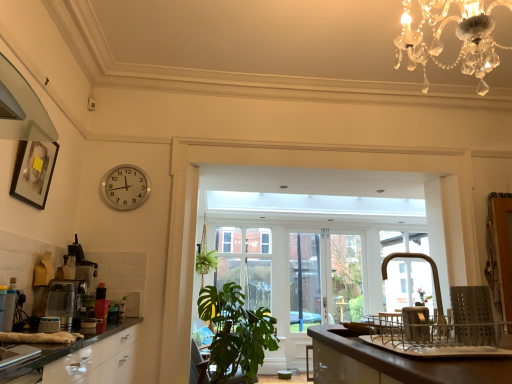
Find the location of a particular element. The width and height of the screenshot is (512, 384). brushed metal faucet at right is located at coordinates (432, 274).

Describe the element at coordinates (394, 363) in the screenshot. I see `brown glossy countertop at lower right` at that location.

What do you see at coordinates (245, 262) in the screenshot?
I see `clear glass window at center` at bounding box center [245, 262].

This screenshot has width=512, height=384. I want to click on satin silver dishwasher at lower right, acting as the 2th appliance starting from the left, so click(x=416, y=323).

Looking at this image, what is the approximate width of green leafy plant at lower center?

83.72 centimeters.

This screenshot has height=384, width=512. I want to click on satin silver coffee machine at left, which is counted as the first coffee machine, starting from the front, so click(x=64, y=301).

Would you say metallic silver toaster at left, which is the 2th appliance in right-to-left order, is a long distance from satin silver dishwasher at lower right, which ranks as the 2th appliance in back-to-front order?

Absolutely, metallic silver toaster at left, which is the 2th appliance in right-to-left order, is distant from satin silver dishwasher at lower right, which ranks as the 2th appliance in back-to-front order.

Identify the location of appliance below the satin silver dishwasher at lower right, marked as the first appliance in a right-to-left arrangement (from the image's perspective). (78, 266).

What's the angular difference between metallic silver toaster at left, the 1th appliance positioned from the left, and satin silver dishwasher at lower right, marked as the first appliance in a right-to-left arrangement,'s facing directions?

The facing directions of metallic silver toaster at left, the 1th appliance positioned from the left, and satin silver dishwasher at lower right, marked as the first appliance in a right-to-left arrangement, are 93.1 degrees apart.

Which of these two, metallic silver toaster at left, which ranks as the first appliance in back-to-front order, or satin silver dishwasher at lower right, marked as the first appliance in a right-to-left arrangement, is bigger?

metallic silver toaster at left, which ranks as the first appliance in back-to-front order, is bigger.

Considering the sizes of objects brown glossy countertop at lower right and satin silver dishwasher at lower right, which is counted as the first appliance, starting from the front, in the image provided, who is thinner, brown glossy countertop at lower right or satin silver dishwasher at lower right, which is counted as the first appliance, starting from the front,?

satin silver dishwasher at lower right, which is counted as the first appliance, starting from the front.

How many degrees apart are the facing directions of brown glossy countertop at lower right and satin silver dishwasher at lower right, which is counted as the first appliance, starting from the front?

There is a 94.2-degree angle between the facing directions of brown glossy countertop at lower right and satin silver dishwasher at lower right, which is counted as the first appliance, starting from the front.

Is satin silver dishwasher at lower right, which ranks as the 2th appliance in back-to-front order, at the back of brown glossy countertop at lower right?

Result: That's not correct — brown glossy countertop at lower right is not looking away from satin silver dishwasher at lower right, which ranks as the 2th appliance in back-to-front order.

From a real-world perspective, is brown glossy countertop at lower right positioned above or below satin silver dishwasher at lower right, marked as the first appliance in a right-to-left arrangement?

In terms of real-world spatial position, brown glossy countertop at lower right is below satin silver dishwasher at lower right, marked as the first appliance in a right-to-left arrangement.

Which object is closer to the camera, satin silver dishwasher at lower right, which ranks as the 2th appliance in back-to-front order, or silver metallic clock at upper left?

Positioned in front is satin silver dishwasher at lower right, which ranks as the 2th appliance in back-to-front order.

From a real-world perspective, who is located lower, satin silver dishwasher at lower right, which ranks as the 2th appliance in back-to-front order, or silver metallic clock at upper left?

satin silver dishwasher at lower right, which ranks as the 2th appliance in back-to-front order.

Is satin silver dishwasher at lower right, which ranks as the 2th appliance in back-to-front order, looking in the opposite direction of silver metallic clock at upper left?

That's not correct — satin silver dishwasher at lower right, which ranks as the 2th appliance in back-to-front order, is not looking away from silver metallic clock at upper left.

How different are the orientations of satin silver dishwasher at lower right, marked as the first appliance in a right-to-left arrangement, and silver metallic clock at upper left in degrees?

There is a 177-degree angle between the facing directions of satin silver dishwasher at lower right, marked as the first appliance in a right-to-left arrangement, and silver metallic clock at upper left.

Is satin silver coffee machine at left, positioned as the 1th coffee machine in back-to-front order, smaller than metallic silver toaster at left, which ranks as the first appliance in back-to-front order?

Yes.

Is satin silver coffee machine at left, the 2th coffee machine when ordered from front to back, to the left of metallic silver toaster at left, which is the 2th appliance in right-to-left order, from the viewer's perspective?

Incorrect, satin silver coffee machine at left, the 2th coffee machine when ordered from front to back, is not on the left side of metallic silver toaster at left, which is the 2th appliance in right-to-left order.

From a real-world perspective, between satin silver coffee machine at left, the 2th coffee machine when ordered from front to back, and metallic silver toaster at left, which is the second appliance in front-to-back order, who is vertically lower?

satin silver coffee machine at left, the 2th coffee machine when ordered from front to back, from a real-world perspective.

In the scene shown: Is satin silver coffee machine at left, the 2th coffee machine when ordered from front to back, beside metallic silver toaster at left, the 1th appliance positioned from the left?

Absolutely, satin silver coffee machine at left, the 2th coffee machine when ordered from front to back, is next to and touching metallic silver toaster at left, the 1th appliance positioned from the left.

Would you say clear glass window at center contains satin silver coffee machine at left, the 2th coffee machine when ordered from front to back?

That's incorrect, satin silver coffee machine at left, the 2th coffee machine when ordered from front to back, is not inside clear glass window at center.

How different are the orientations of clear glass window at center and satin silver coffee machine at left, the 2th coffee machine when ordered from front to back, in degrees?

They differ by 92.8 degrees in their facing directions.

From a real-world perspective, which is physically above, clear glass window at center or satin silver coffee machine at left, the 2th coffee machine when ordered from front to back?

In real-world perspective, clear glass window at center is above.

Is clear glass window at center oriented towards satin silver coffee machine at left, positioned as the 1th coffee machine in back-to-front order?

Yes, clear glass window at center is facing satin silver coffee machine at left, positioned as the 1th coffee machine in back-to-front order.

In terms of size, does satin silver dishwasher at lower right, acting as the 2th appliance starting from the left, appear bigger or smaller than satin silver coffee machine at left, placed as the second coffee machine when sorted from back to front?

Considering their sizes, satin silver dishwasher at lower right, acting as the 2th appliance starting from the left, takes up less space than satin silver coffee machine at left, placed as the second coffee machine when sorted from back to front.

Considering the positions of points (424, 323) and (64, 296), is point (424, 323) closer to camera compared to point (64, 296)?

That is True.

Is satin silver dishwasher at lower right, acting as the 2th appliance starting from the left, facing towards satin silver coffee machine at left, which is counted as the first coffee machine, starting from the front?

No, satin silver dishwasher at lower right, acting as the 2th appliance starting from the left, is not facing towards satin silver coffee machine at left, which is counted as the first coffee machine, starting from the front.

In the image, is satin silver dishwasher at lower right, acting as the 2th appliance starting from the left, positioned in front of or behind satin silver coffee machine at left, placed as the second coffee machine when sorted from back to front?

satin silver dishwasher at lower right, acting as the 2th appliance starting from the left, is positioned closer to the viewer than satin silver coffee machine at left, placed as the second coffee machine when sorted from back to front.

The width and height of the screenshot is (512, 384). I want to click on houseplant in front of the clear glass door at center, so click(x=236, y=332).

Based on their sizes in the image, would you say clear glass door at center is bigger or smaller than green leafy plant at lower center?

clear glass door at center is smaller than green leafy plant at lower center.

Between clear glass door at center and green leafy plant at lower center, which one has more height?

clear glass door at center.

Is green leafy plant at lower center completely or partially inside clear glass door at center?

No, clear glass door at center does not contain green leafy plant at lower center.

Where is `appliance behind the satin silver dishwasher at lower right, which is counted as the first appliance, starting from the front`? This screenshot has height=384, width=512. appliance behind the satin silver dishwasher at lower right, which is counted as the first appliance, starting from the front is located at coordinates (78, 266).

At what (x,y) coordinates should I click in order to perform the action: click on the 1st appliance to the left when counting from the brown glossy countertop at lower right. Please return your answer as a coordinate pair (x, y). The image size is (512, 384). Looking at the image, I should click on (416, 323).

When comparing their distances from clear glass door at center, does satin silver dishwasher at lower right, marked as the first appliance in a right-to-left arrangement, or silver metallic clock at upper left seem further?

satin silver dishwasher at lower right, marked as the first appliance in a right-to-left arrangement.

Estimate the real-world distances between objects in this image. Which object is closer to clear glass window at center, satin silver coffee machine at left, placed as the second coffee machine when sorted from back to front, or clear glass door at center?

Among the two, clear glass door at center is located nearer to clear glass window at center.

Which object lies nearer to the anchor point satin silver dishwasher at lower right, which is counted as the first appliance, starting from the front, clear glass door at center or brushed metal faucet at right?

brushed metal faucet at right lies closer to satin silver dishwasher at lower right, which is counted as the first appliance, starting from the front, than the other object.

Based on their spatial positions, is silver metallic clock at upper left or clear glass door at center closer to green leafy plant at lower center?

Based on the image, silver metallic clock at upper left appears to be nearer to green leafy plant at lower center.

Estimate the real-world distances between objects in this image. Which object is closer to satin silver dishwasher at lower right, which is counted as the first appliance, starting from the front, green leafy plant at lower center or clear glass window at center?

green leafy plant at lower center is positioned closer to the anchor satin silver dishwasher at lower right, which is counted as the first appliance, starting from the front.

Looking at this image, which object lies nearer to the anchor point silver metallic clock at upper left, brushed metal faucet at right or green leafy plant at lower center?

green leafy plant at lower center lies closer to silver metallic clock at upper left than the other object.

From the image, which object appears to be farther from metallic silver toaster at left, the 1th appliance positioned from the left, clear glass window at center or brushed metal faucet at right?

clear glass window at center is further to metallic silver toaster at left, the 1th appliance positioned from the left.

Which object lies nearer to the anchor point silver metallic clock at upper left, brushed metal faucet at right or clear glass window at center?

brushed metal faucet at right is positioned closer to the anchor silver metallic clock at upper left.

Locate an element on the screen. window between satin silver coffee machine at left, positioned as the 1th coffee machine in back-to-front order, and clear glass door at center from front to back is located at coordinates (245, 262).

I want to click on clock situated between satin silver coffee machine at left, positioned as the 1th coffee machine in back-to-front order, and brushed metal faucet at right from left to right, so click(125, 187).

Image resolution: width=512 pixels, height=384 pixels. Find the location of `clock between brown glossy countertop at lower right and clear glass door at center along the z-axis`. clock between brown glossy countertop at lower right and clear glass door at center along the z-axis is located at coordinates click(125, 187).

Find the location of a particular element. This screenshot has width=512, height=384. appliance between satin silver coffee machine at left, placed as the second coffee machine when sorted from back to front, and brushed metal faucet at right is located at coordinates (416, 323).